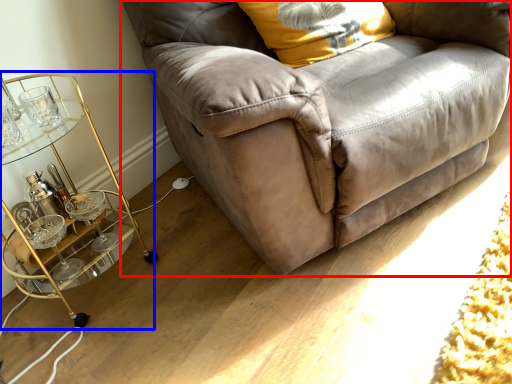
Question: Which point is further to the camera, studio couch (highlighted by a red box) or table (highlighted by a blue box)?

Choices:
 (A) studio couch
 (B) table

Answer: (B)